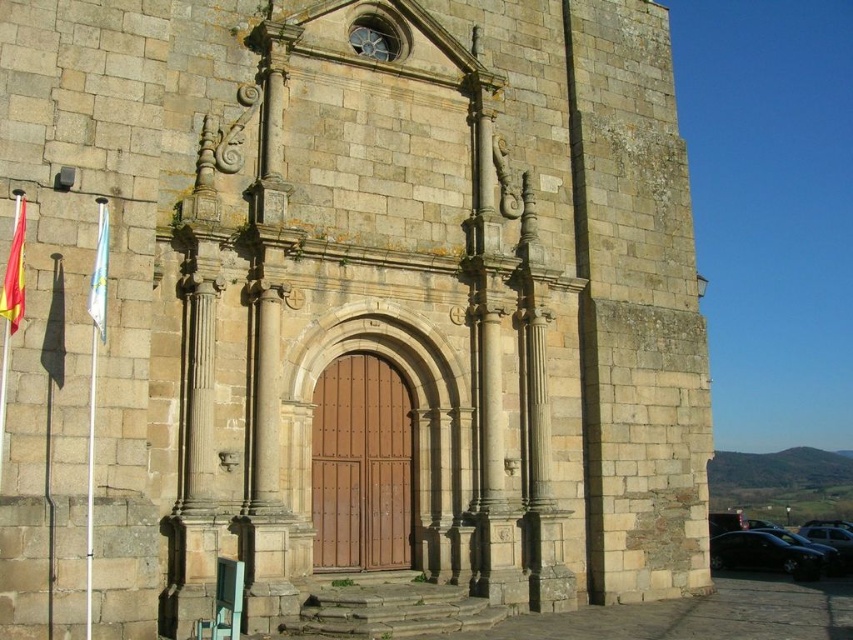
You are a photographer setting up a tripod to capture the historic stone building. You need to position your camera so that both the shiny black car at lower right and the white fabric flag at left are visible in the frame. Considering their sizes, which object should you ensure is closer to the center of the frame to avoid cropping?

The shiny black car at lower right has a larger width than the white fabric flag at left, so to avoid cropping, you should position the shiny black car at lower right closer to the center of the frame.

You are standing in front of the historic stone building and want to determine the relative positions of two points marked on the facade. Which point is closer to you, point (709, 544) or point (102, 310)?

Point (709, 544) is further to the viewer than point (102, 310), so point (102, 310) is closer to you.

You are standing in front of the historic stone building and notice two points marked on its facade. The first point is at coordinate point (13,248) and the second is at point (106,205). Which of these two points appears closer to you?

Point (13,248) is closer to the camera than point (106,205), so the first point appears closer to you.